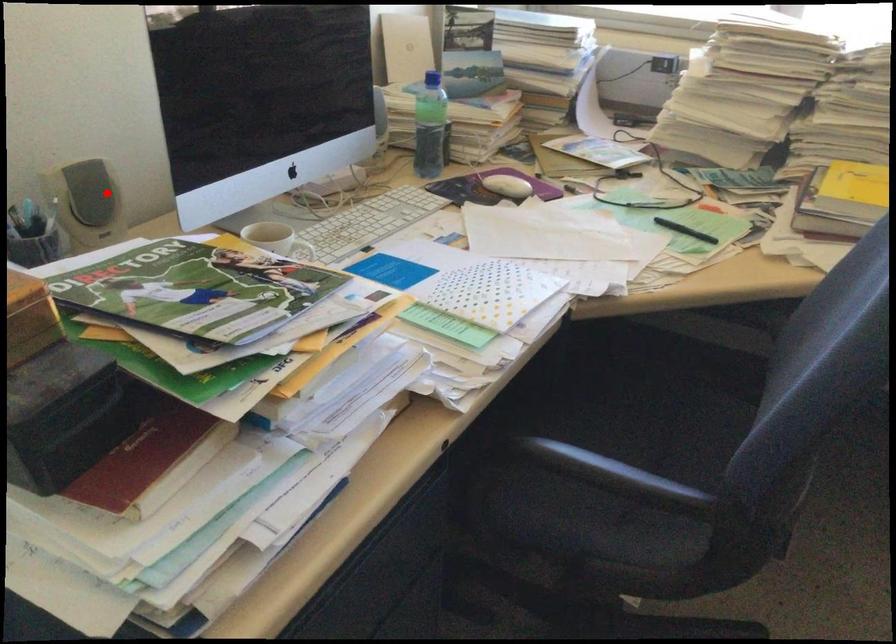
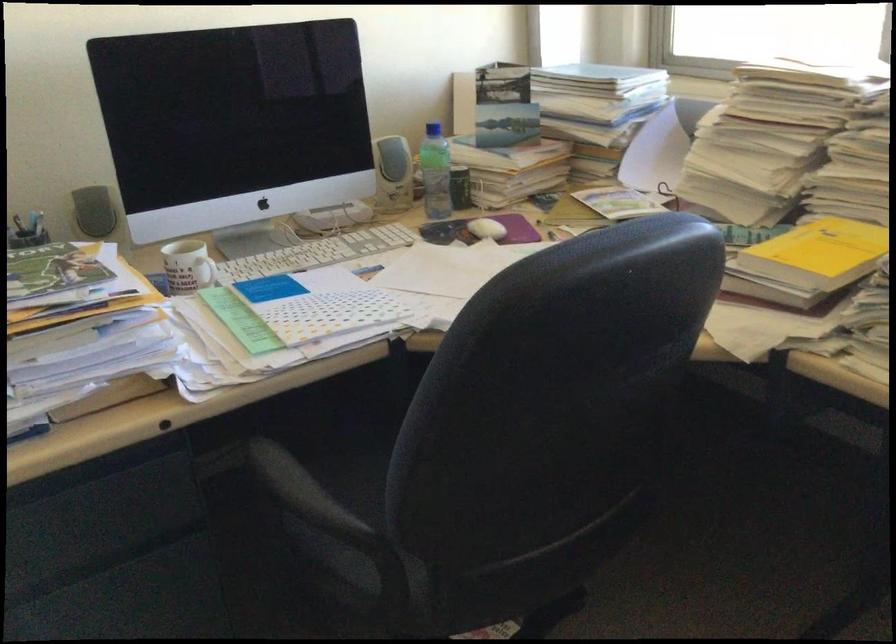
Find the pixel in the second image that matches the highlighted location in the first image.

(93, 211)